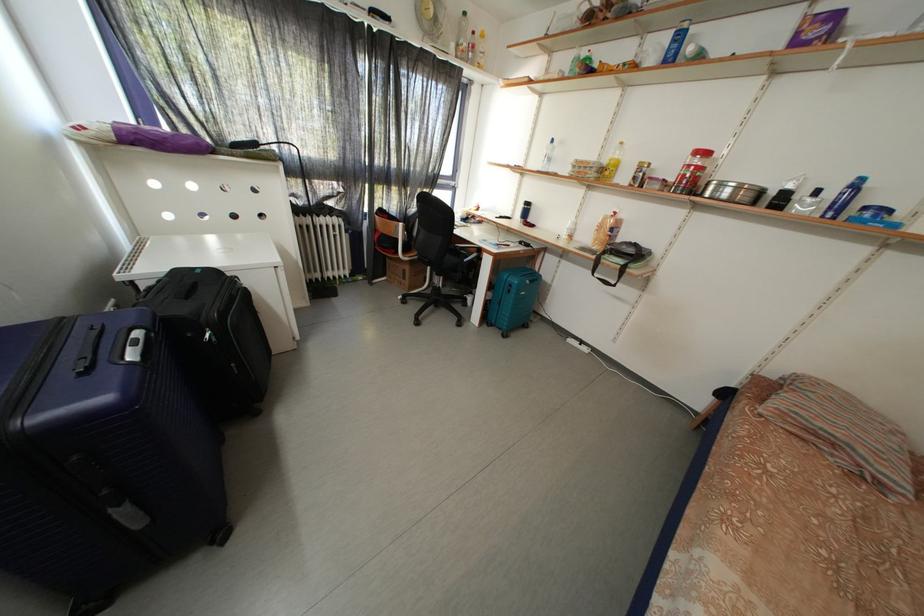
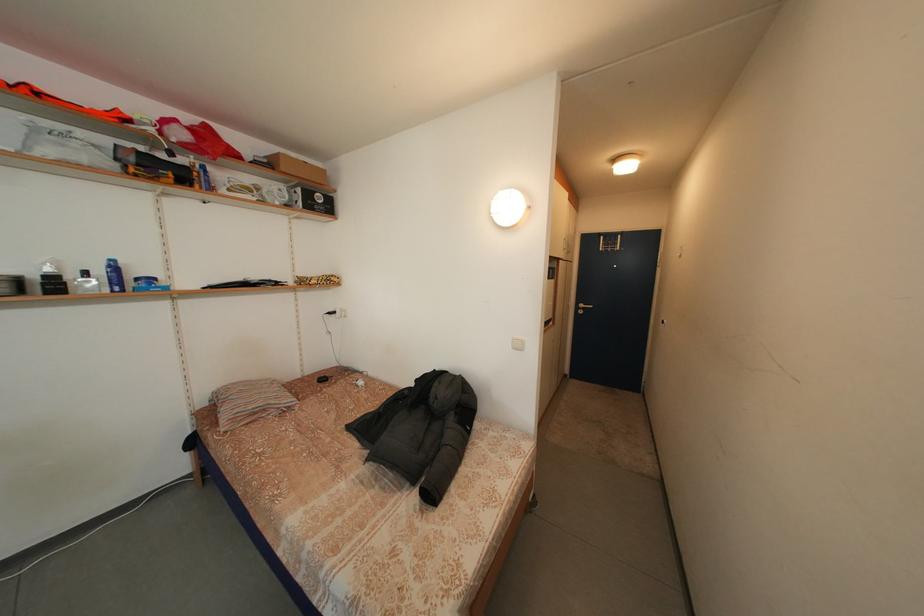
The images are taken continuously from a first-person perspective. In which direction is your viewpoint rotating?

The rotation direction of the camera is right-down.